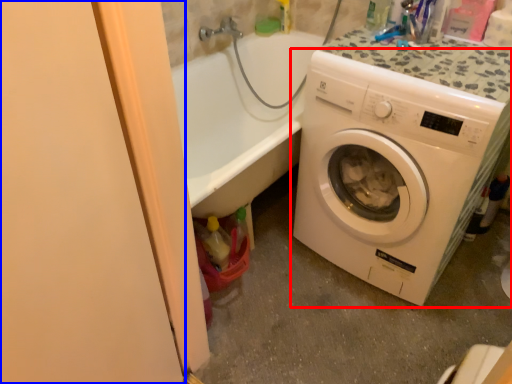
Question: Which point is closer to the camera, washing machine (highlighted by a red box) or screen door (highlighted by a blue box)?

Choices:
 (A) washing machine
 (B) screen door

Answer: (B)